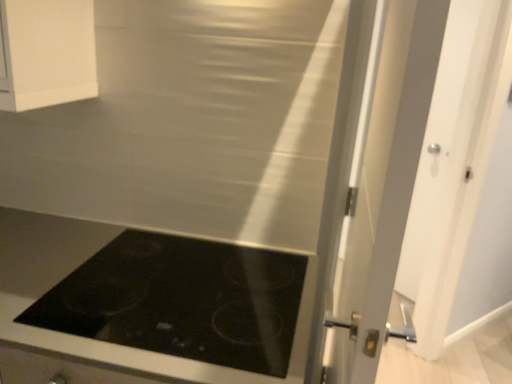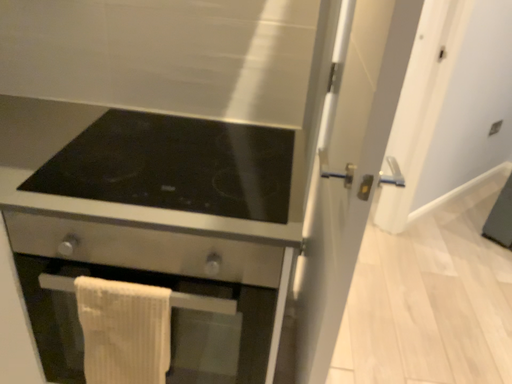
Question: Which way did the camera rotate in the video?

Choices:
 (A) rotated upward
 (B) rotated downward

Answer: (B)